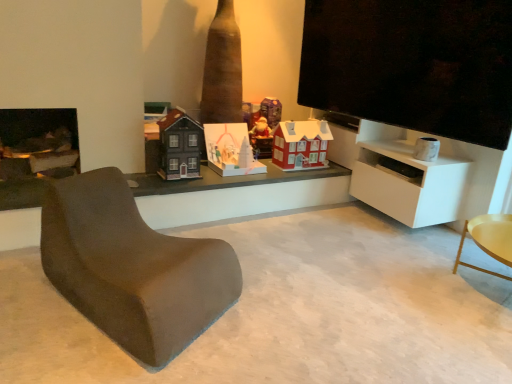
Identify the location of free space in front of matte black house at center, marked as the first toy in a left-to-right arrangement. (170, 182).